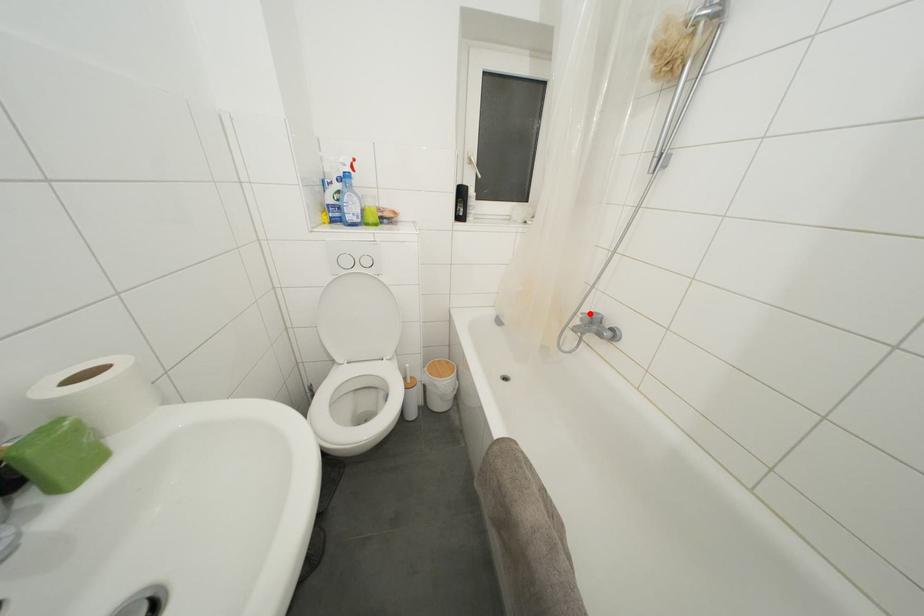
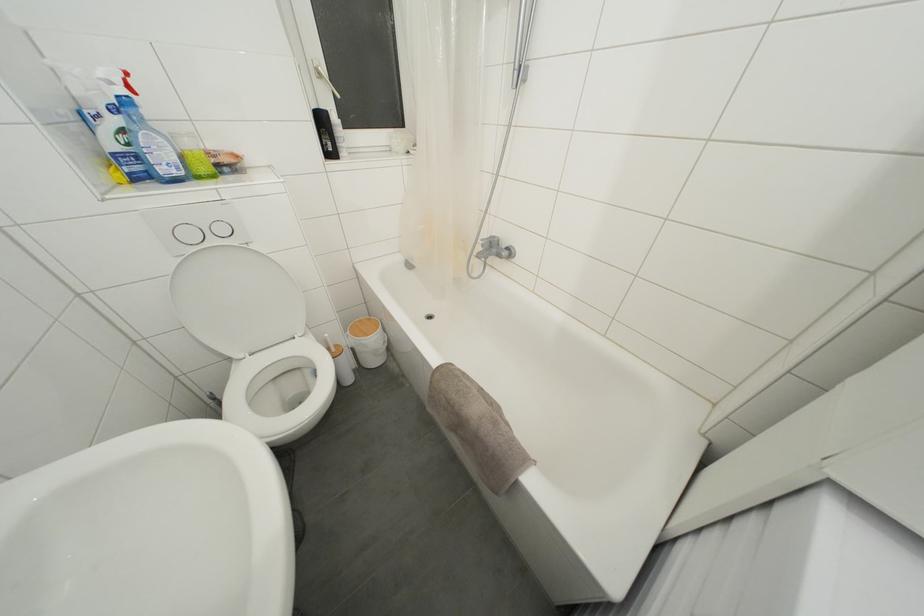
Find the pixel in the second image that matches the highlighted location in the first image.

(488, 240)